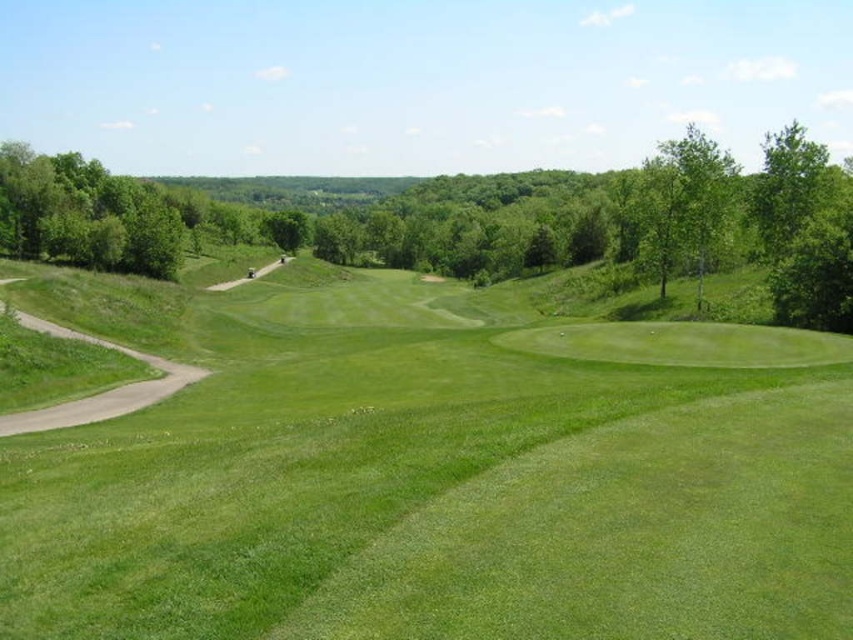
Question: Where is green grassy golf course at center located in relation to green leafy tree at center in the image?

Choices:
 (A) above
 (B) below

Answer: (B)

Question: Which of the following is the closest to the observer?

Choices:
 (A) (834, 246)
 (B) (543, 634)

Answer: (B)

Question: Among these points, which one is nearest to the camera?

Choices:
 (A) (299, 513)
 (B) (711, 209)

Answer: (A)

Question: Does green grassy golf course at center come in front of green leafy tree at center?

Choices:
 (A) yes
 (B) no

Answer: (A)

Question: Does green grassy golf course at center have a greater width compared to green leafy tree at center?

Choices:
 (A) yes
 (B) no

Answer: (B)